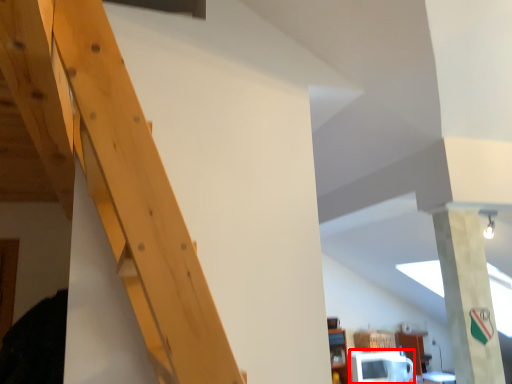
Question: In this image, where is microwave (annotated by the red box) located relative to pillar?

Choices:
 (A) right
 (B) left

Answer: (A)